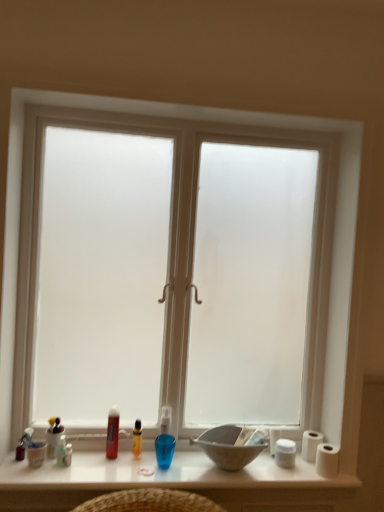
Question: In which direction should I rotate to look at translucent plastic tube at lower center, the fourth toiletry viewed from the left?

Choices:
 (A) left
 (B) right

Answer: (A)

Question: Is matte white cup at lower left, placed as the 2th toiletry when sorted from left to right, oriented towards translucent plastic container at lower left, positioned as the 1th toiletry in left-to-right order?

Choices:
 (A) yes
 (B) no

Answer: (B)

Question: Considering the relative sizes of matte white cup at lower left, the 4th toiletry viewed from the right, and translucent plastic container at lower left, which is counted as the fifth toiletry, starting from the right, in the image provided, is matte white cup at lower left, the 4th toiletry viewed from the right, thinner than translucent plastic container at lower left, which is counted as the fifth toiletry, starting from the right,?

Choices:
 (A) yes
 (B) no

Answer: (A)

Question: Is matte white cup at lower left, the 4th toiletry viewed from the right, positioned far away from translucent plastic container at lower left, which is counted as the fifth toiletry, starting from the right?

Choices:
 (A) yes
 (B) no

Answer: (B)

Question: Does matte white cup at lower left, placed as the 2th toiletry when sorted from left to right, appear on the right side of translucent plastic container at lower left, positioned as the 1th toiletry in left-to-right order?

Choices:
 (A) no
 (B) yes

Answer: (B)

Question: From a real-world perspective, is matte white cup at lower left, placed as the 2th toiletry when sorted from left to right, positioned under translucent plastic container at lower left, which is counted as the fifth toiletry, starting from the right, based on gravity?

Choices:
 (A) no
 (B) yes

Answer: (B)

Question: Does matte white cup at lower left, the 4th toiletry viewed from the right, have a smaller size compared to translucent plastic container at lower left, positioned as the 1th toiletry in left-to-right order?

Choices:
 (A) no
 (B) yes

Answer: (B)

Question: Could you tell me if white matte toilet paper at right, the first toilet paper positioned from the front, is facing frosted glass window at center?

Choices:
 (A) yes
 (B) no

Answer: (A)

Question: Would you say white matte toilet paper at right, the first toilet paper positioned from the front, contains frosted glass window at center?

Choices:
 (A) yes
 (B) no

Answer: (B)

Question: Is the position of white matte toilet paper at right, placed as the second toilet paper when sorted from back to front, less distant than that of frosted glass window at center?

Choices:
 (A) no
 (B) yes

Answer: (A)

Question: Considering the relative sizes of white matte toilet paper at right, the first toilet paper positioned from the front, and frosted glass window at center in the image provided, is white matte toilet paper at right, the first toilet paper positioned from the front, thinner than frosted glass window at center?

Choices:
 (A) no
 (B) yes

Answer: (B)

Question: From a real-world perspective, is white matte toilet paper at right, the first toilet paper positioned from the front, over frosted glass window at center?

Choices:
 (A) yes
 (B) no

Answer: (B)

Question: Is white matte toilet paper at right, placed as the second toilet paper when sorted from back to front, positioned beyond the bounds of frosted glass window at center?

Choices:
 (A) no
 (B) yes

Answer: (A)

Question: Is matte white cup at lower left, the 4th toiletry viewed from the right, bigger than white matte toilet paper at right, the first toilet paper positioned from the front?

Choices:
 (A) no
 (B) yes

Answer: (A)